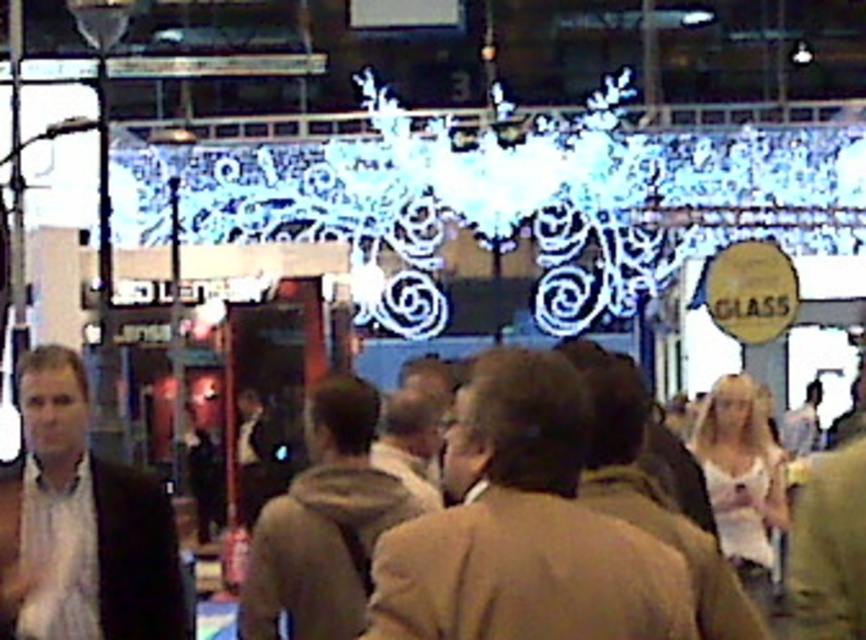
Question: Does brown fabric jacket at center appear under white shirt at left?

Choices:
 (A) no
 (B) yes

Answer: (A)

Question: Is brown fabric jacket at center positioned before brown fuzzy jacket at center?

Choices:
 (A) yes
 (B) no

Answer: (A)

Question: Can you confirm if white shirt at left is positioned above brown fuzzy jacket at center?

Choices:
 (A) yes
 (B) no

Answer: (B)

Question: Which of the following is the closest to the observer?

Choices:
 (A) (301, 596)
 (B) (514, 554)

Answer: (B)

Question: Which point is closer to the camera taking this photo?

Choices:
 (A) (469, 532)
 (B) (141, 509)

Answer: (A)

Question: Which point appears closest to the camera in this image?

Choices:
 (A) [x=456, y=470]
 (B) [x=21, y=476]

Answer: (A)